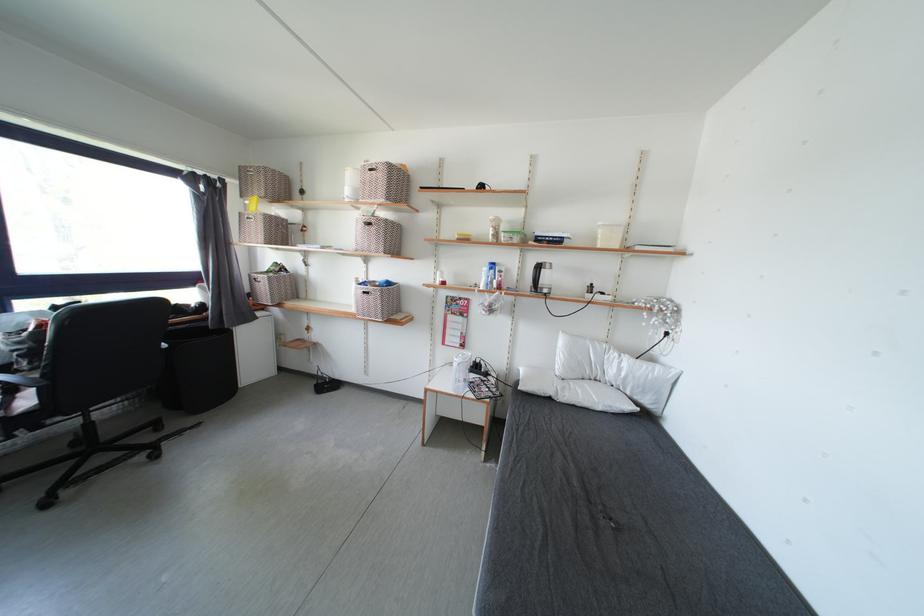
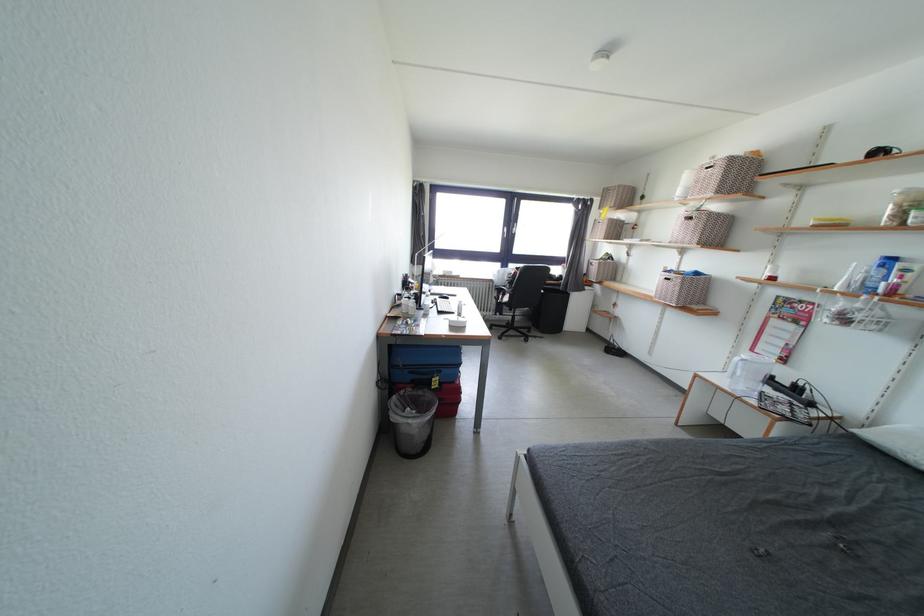
In the second image, find the point that corresponds to point 244,309 in the first image.

(584, 284)